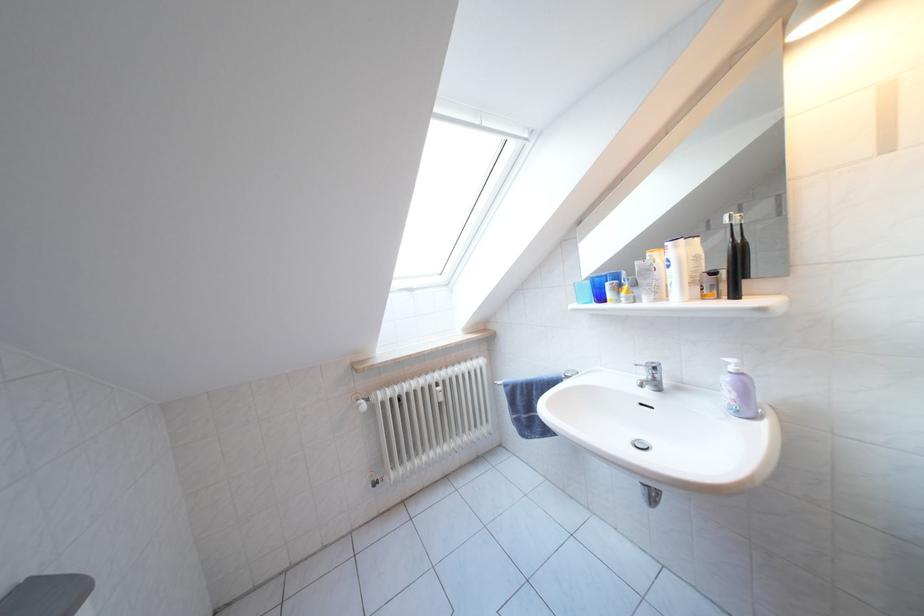
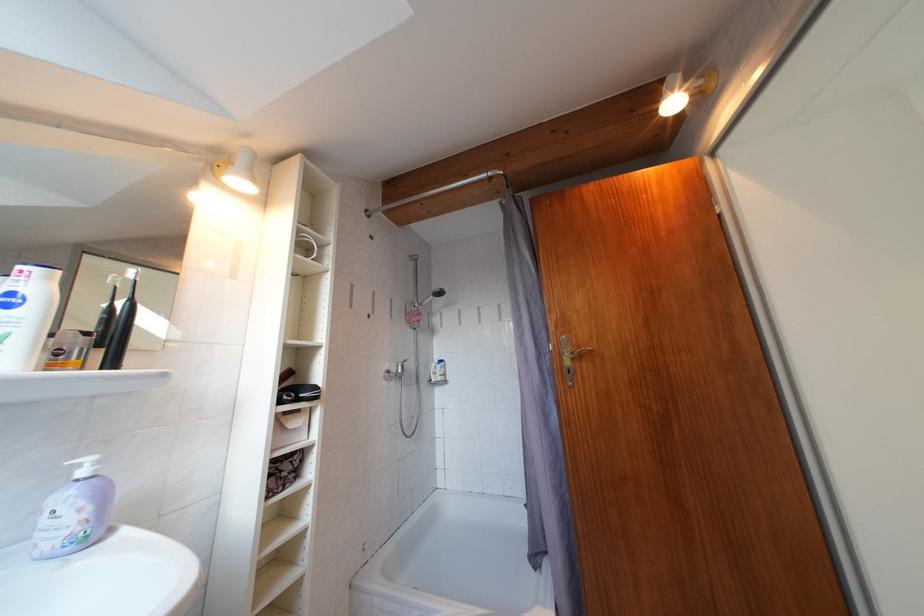
In the second image, find the point that corresponds to the point at 739,374 in the first image.

(92, 477)